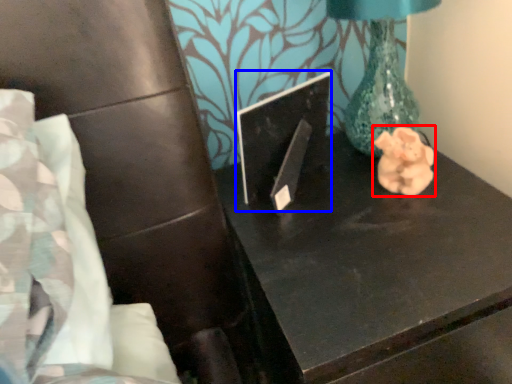
Question: Which object is further to the camera taking this photo, animal (highlighted by a red box) or laptop (highlighted by a blue box)?

Choices:
 (A) animal
 (B) laptop

Answer: (A)